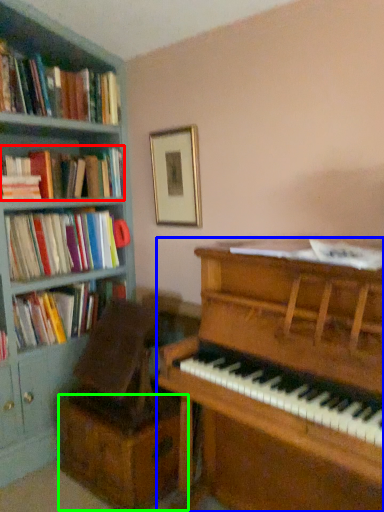
Question: Which object is the farthest from book (highlighted by a red box)? Choose among these: piano (highlighted by a blue box) or drawer (highlighted by a green box).

Choices:
 (A) piano
 (B) drawer

Answer: (A)